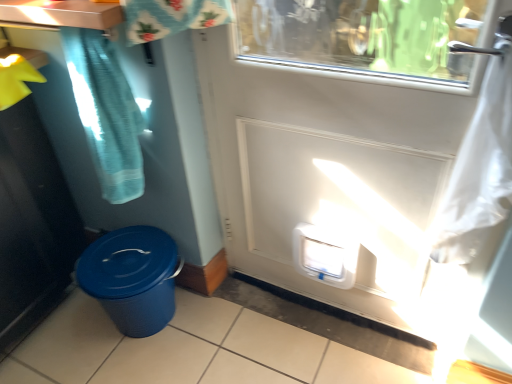
Image resolution: width=512 pixels, height=384 pixels. What do you see at coordinates (60, 14) in the screenshot?
I see `brushed metal counter top at upper left` at bounding box center [60, 14].

Locate an element on the screen. This screenshot has height=384, width=512. brushed metal counter top at upper left is located at coordinates [x=60, y=14].

Is there a large distance between white plastic door at center and blue textured plastic bin at lower left?

No, white plastic door at center is in close proximity to blue textured plastic bin at lower left.

Is white plastic door at center behind blue textured plastic bin at lower left?

No, white plastic door at center is closer to the camera.

From the picture: Does white plastic door at center turn towards blue textured plastic bin at lower left?

No.

From a real-world perspective, which is physically below, white plastic door at center or blue textured plastic bin at lower left?

blue textured plastic bin at lower left.

Is brushed metal counter top at upper left wider than teal fabric shower curtain at upper left?

Yes, brushed metal counter top at upper left is wider than teal fabric shower curtain at upper left.

Between point (87, 22) and point (84, 72), which one is positioned in front?

Positioned in front is point (87, 22).

Are brushed metal counter top at upper left and teal fabric shower curtain at upper left beside each other?

No, brushed metal counter top at upper left is not beside teal fabric shower curtain at upper left.

Is teal fabric shower curtain at upper left wider or thinner than brushed metal counter top at upper left?

In the image, teal fabric shower curtain at upper left appears to be more narrow than brushed metal counter top at upper left.

Locate an element on the screen. counter top that is above the teal fabric shower curtain at upper left (from a real-world perspective) is located at coordinates (60, 14).

Who is smaller, teal fabric shower curtain at upper left or brushed metal counter top at upper left?

brushed metal counter top at upper left is smaller.

How far apart are teal fabric shower curtain at upper left and blue textured plastic bin at lower left?

The distance of teal fabric shower curtain at upper left from blue textured plastic bin at lower left is 15.23 inches.

Is blue textured plastic bin at lower left at the back of teal fabric shower curtain at upper left?

No.

Is blue textured plastic bin at lower left inside teal fabric shower curtain at upper left?

No, teal fabric shower curtain at upper left does not contain blue textured plastic bin at lower left.

Considering the positions of objects teal fabric shower curtain at upper left and blue textured plastic bin at lower left in the image provided, who is more to the left, teal fabric shower curtain at upper left or blue textured plastic bin at lower left?

From the viewer's perspective, blue textured plastic bin at lower left appears more on the left side.

Does point (105, 50) come farther from viewer compared to point (296, 130)?

No, it is in front of (296, 130).

From the image's perspective, between teal fabric shower curtain at upper left and white plastic door at center, who is located below?

From the image's view, white plastic door at center is below.

Does teal fabric shower curtain at upper left have a greater height compared to white plastic door at center?

No.

Is teal fabric shower curtain at upper left not inside white plastic door at center?

Absolutely, teal fabric shower curtain at upper left is external to white plastic door at center.

From a real-world perspective, is white plastic door at center above or below brushed metal counter top at upper left?

Clearly, from a real-world perspective, white plastic door at center is below brushed metal counter top at upper left.

Which is behind, point (447, 173) or point (51, 24)?

The point (447, 173) is farther.

Is white plastic door at center to the left of brushed metal counter top at upper left from the viewer's perspective?

No, white plastic door at center is not to the left of brushed metal counter top at upper left.

Considering the relative positions of white plastic door at center and brushed metal counter top at upper left in the image provided, is white plastic door at center in front of brushed metal counter top at upper left?

Yes.

In the scene shown: Considering the relative sizes of blue textured plastic bin at lower left and teal fabric shower curtain at upper left in the image provided, is blue textured plastic bin at lower left taller than teal fabric shower curtain at upper left?

Incorrect, the height of blue textured plastic bin at lower left is not larger of that of teal fabric shower curtain at upper left.

From a real-world perspective, is blue textured plastic bin at lower left positioned under teal fabric shower curtain at upper left based on gravity?

Yes, from a real-world perspective, blue textured plastic bin at lower left is beneath teal fabric shower curtain at upper left.

Does blue textured plastic bin at lower left touch teal fabric shower curtain at upper left?

blue textured plastic bin at lower left and teal fabric shower curtain at upper left are clearly separated.

In order to click on shower curtain located above the blue textured plastic bin at lower left (from the image's perspective) in this screenshot , I will do `click(106, 113)`.

Find the location of a particular element. waste container lying behind the white plastic door at center is located at coordinates (132, 278).

The image size is (512, 384). What are the coordinates of `counter top on the left of teal fabric shower curtain at upper left` in the screenshot? It's located at (60, 14).

Which object lies further to the anchor point white plastic door at center, teal fabric shower curtain at upper left or white plastic water cooler at lower center?

The object further to white plastic door at center is teal fabric shower curtain at upper left.

Considering their positions, is teal fabric shower curtain at upper left positioned closer to brushed metal counter top at upper left than white plastic door at center?

Among the two, teal fabric shower curtain at upper left is located nearer to brushed metal counter top at upper left.

Considering their positions, is teal fabric shower curtain at upper left positioned further to brushed metal counter top at upper left than blue textured plastic bin at lower left?

blue textured plastic bin at lower left is further to brushed metal counter top at upper left.

Which object lies further to the anchor point white plastic water cooler at lower center, brushed metal counter top at upper left or teal fabric shower curtain at upper left?

brushed metal counter top at upper left lies further to white plastic water cooler at lower center than the other object.

Which object lies further to the anchor point teal fabric shower curtain at upper left, brushed metal counter top at upper left or white plastic door at center?

white plastic door at center is positioned further to the anchor teal fabric shower curtain at upper left.

Consider the image. Based on their spatial positions, is white plastic door at center or blue textured plastic bin at lower left closer to white plastic water cooler at lower center?

white plastic door at center is closer to white plastic water cooler at lower center.

Based on their spatial positions, is white plastic door at center or white plastic water cooler at lower center further from teal fabric shower curtain at upper left?

The object further to teal fabric shower curtain at upper left is white plastic water cooler at lower center.

From the image, which object appears to be nearer to white plastic door at center, white plastic water cooler at lower center or teal fabric shower curtain at upper left?

Among the two, white plastic water cooler at lower center is located nearer to white plastic door at center.

Find the location of a particular element. water cooler that lies between brushed metal counter top at upper left and blue textured plastic bin at lower left from top to bottom is located at coordinates (325, 255).

The width and height of the screenshot is (512, 384). I want to click on water cooler located between teal fabric shower curtain at upper left and white plastic door at center in the left-right direction, so click(x=325, y=255).

Identify the location of waste container between brushed metal counter top at upper left and white plastic door at center in the horizontal direction. (132, 278).

At what (x,y) coordinates should I click in order to perform the action: click on shower curtain between brushed metal counter top at upper left and white plastic door at center. Please return your answer as a coordinate pair (x, y). Looking at the image, I should click on (106, 113).